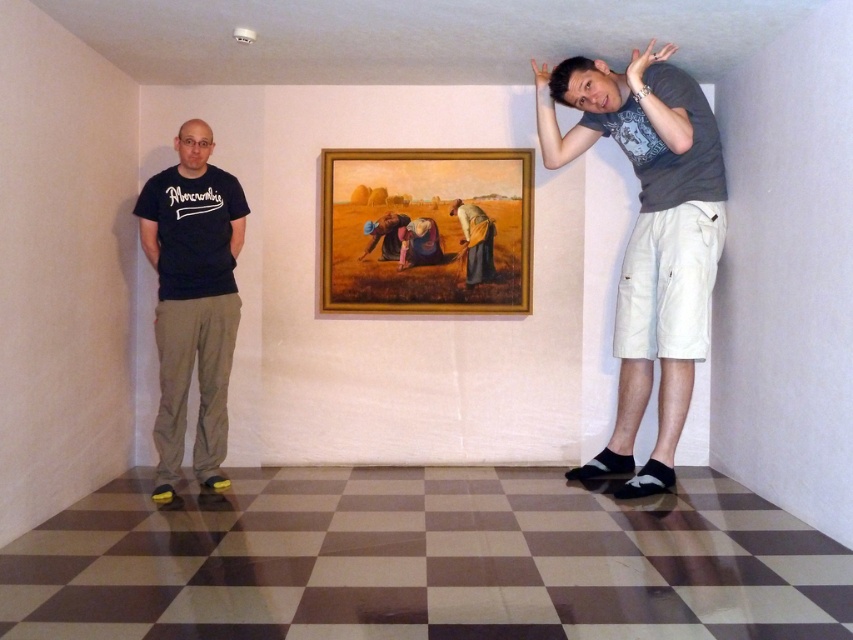
Who is positioned more to the right, gray cotton t-shirt at upper right or brown fabric dress at center?

Positioned to the right is gray cotton t-shirt at upper right.

Locate an element on the screen. The width and height of the screenshot is (853, 640). gray cotton t-shirt at upper right is located at coordinates (648, 236).

Which of these two, wooden frame at center or black cotton t-shirt at left, stands taller?

black cotton t-shirt at left is taller.

Can you confirm if wooden frame at center is bigger than black cotton t-shirt at left?

Actually, wooden frame at center might be smaller than black cotton t-shirt at left.

Image resolution: width=853 pixels, height=640 pixels. In order to click on wooden frame at center in this screenshot , I will do `click(426, 228)`.

Does gray cotton t-shirt at upper right have a smaller size compared to wooden frame at center?

Incorrect, gray cotton t-shirt at upper right is not smaller in size than wooden frame at center.

Does gray cotton t-shirt at upper right have a greater width compared to wooden frame at center?

In fact, gray cotton t-shirt at upper right might be narrower than wooden frame at center.

Between point (688, 234) and point (440, 179), which one is positioned in front?

Point (688, 234)

The image size is (853, 640). Find the location of `gray cotton t-shirt at upper right`. gray cotton t-shirt at upper right is located at coordinates (648, 236).